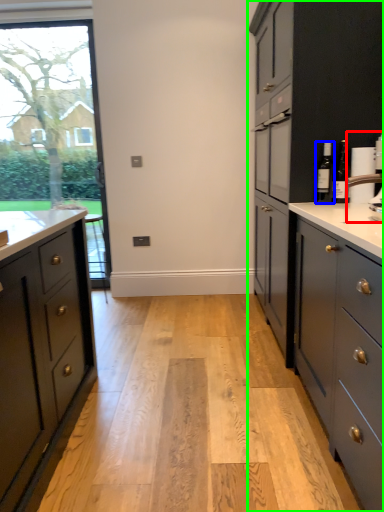
Question: Which object is the closest to the coffee machine (highlighted by a red box)? Choose among these: bottle (highlighted by a blue box) or cabinetry (highlighted by a green box).

Choices:
 (A) bottle
 (B) cabinetry

Answer: (A)